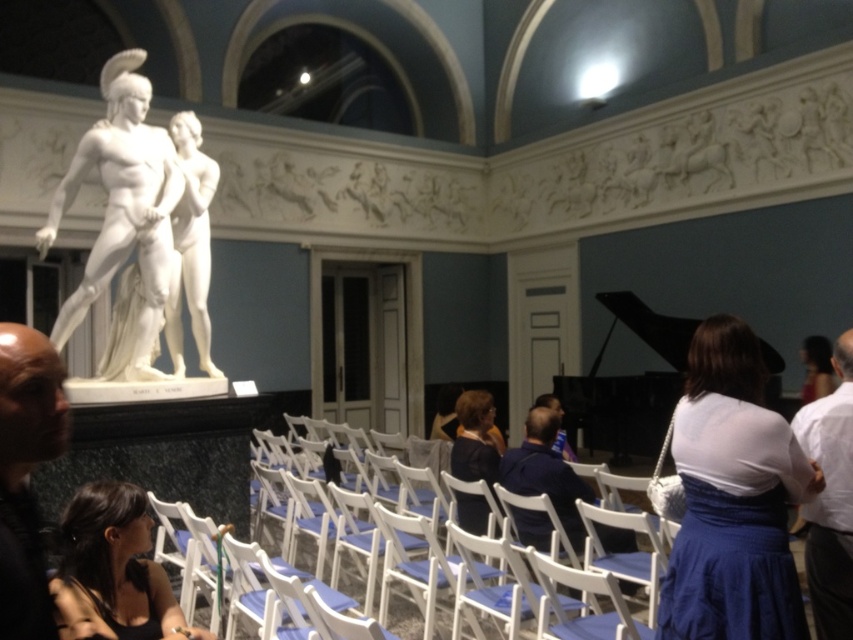
Can you confirm if white fabric dress at right is bigger than bald head at left?

Yes, white fabric dress at right is bigger than bald head at left.

Does white fabric dress at right appear on the left side of bald head at left?

No, white fabric dress at right is not to the left of bald head at left.

Image resolution: width=853 pixels, height=640 pixels. Describe the element at coordinates (733, 499) in the screenshot. I see `white fabric dress at right` at that location.

I want to click on white fabric dress at right, so click(733, 499).

Which is below, white marble statue at upper left or white cotton shirt at right?

white cotton shirt at right is lower down.

Find the location of `white marble statue at upper left`. white marble statue at upper left is located at coordinates (134, 232).

Is black fabric dress at lower left thinner than white wood chair at center?

Yes.

What do you see at coordinates (113, 570) in the screenshot? I see `black fabric dress at lower left` at bounding box center [113, 570].

Measure the distance between black fabric dress at lower left and camera.

9.13 feet

The width and height of the screenshot is (853, 640). What are the coordinates of `black fabric dress at lower left` in the screenshot? It's located at (113, 570).